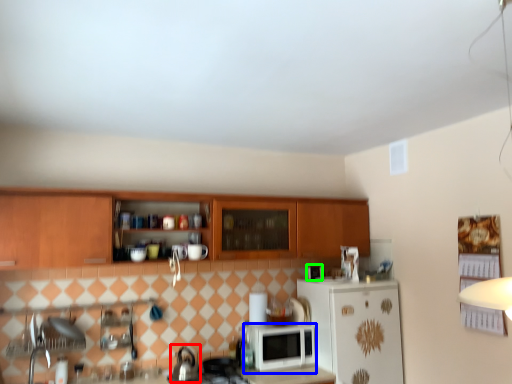
Question: Considering the real-world distances, which object is farthest from tea pot (highlighted by a red box)? microwave oven (highlighted by a blue box) or appliance (highlighted by a green box)?

Choices:
 (A) microwave oven
 (B) appliance

Answer: (B)